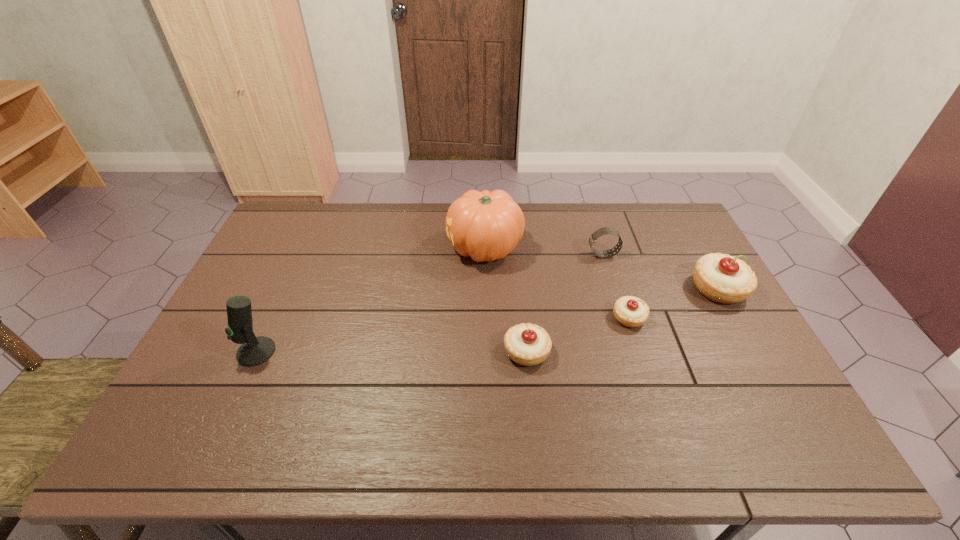
Find the location of a particular element. unoccupied area between the watch and the pumpkin is located at coordinates (544, 252).

The width and height of the screenshot is (960, 540). I want to click on free space between the pumpkin and the watch, so pos(544,252).

Find the location of a particular element. The width and height of the screenshot is (960, 540). empty location between the second pastry from left to right and the pumpkin is located at coordinates (557, 283).

Image resolution: width=960 pixels, height=540 pixels. I want to click on free spot between the leftmost pastry and the watch, so click(564, 303).

At what (x,y) coordinates should I click in order to perform the action: click on empty location between the leftmost pastry and the shortest object. Please return your answer as a coordinate pair (x, y). The height and width of the screenshot is (540, 960). Looking at the image, I should click on (578, 335).

Find the location of a particular element. This screenshot has width=960, height=540. free space between the watch and the shortest object is located at coordinates (616, 286).

Where is `object that is the second nearest to the microphone`? object that is the second nearest to the microphone is located at coordinates (528, 344).

In order to click on object that stands as the fifth closest to the microphone in this screenshot , I will do [722, 278].

At what (x,y) coordinates should I click in order to perform the action: click on pastry identified as the closest to the second tallest pastry. Please return your answer as a coordinate pair (x, y). Looking at the image, I should click on (630, 311).

Locate which pastry ranks second in proximity to the nearest pastry. Please provide its 2D coordinates. Your answer should be formatted as a tuple, i.e. [(x, y)], where the tuple contains the x and y coordinates of a point satisfying the conditions above.

[(722, 278)]